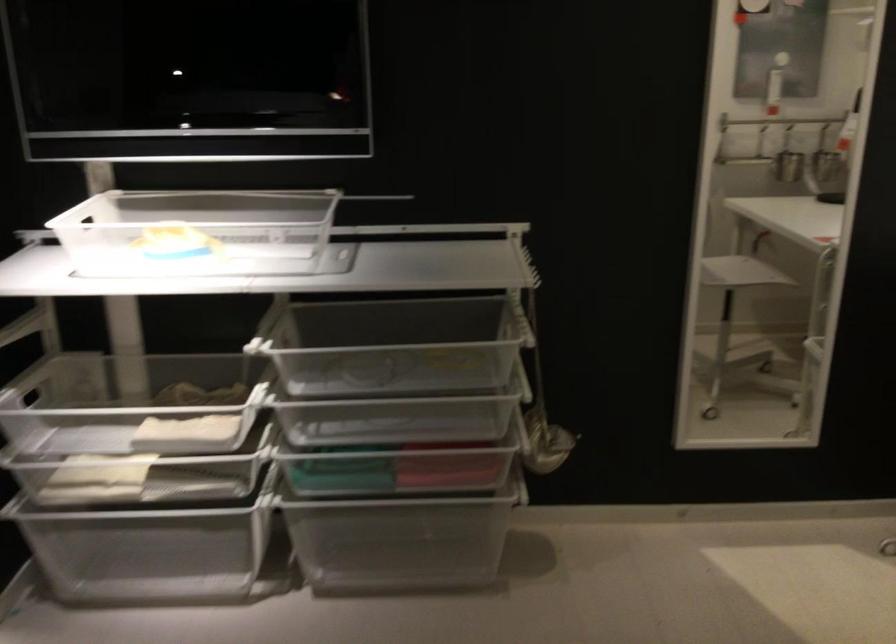
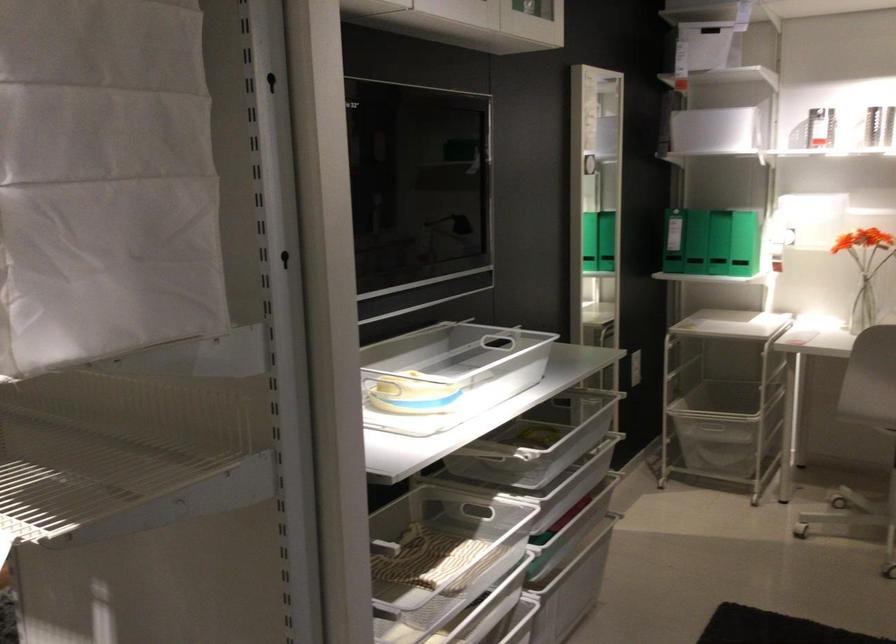
In the second image, find the point that corresponds to (x=158, y=274) in the first image.

(409, 392)